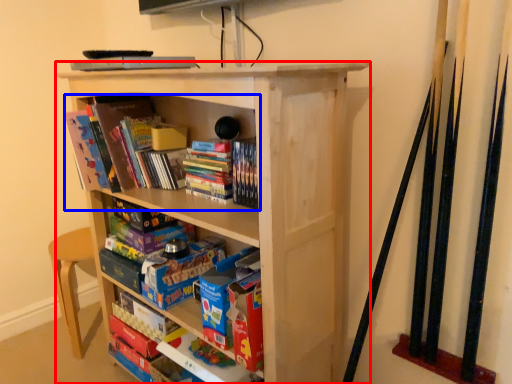
Question: Which point is further to the camera, bookcase (highlighted by a red box) or book (highlighted by a blue box)?

Choices:
 (A) bookcase
 (B) book

Answer: (B)